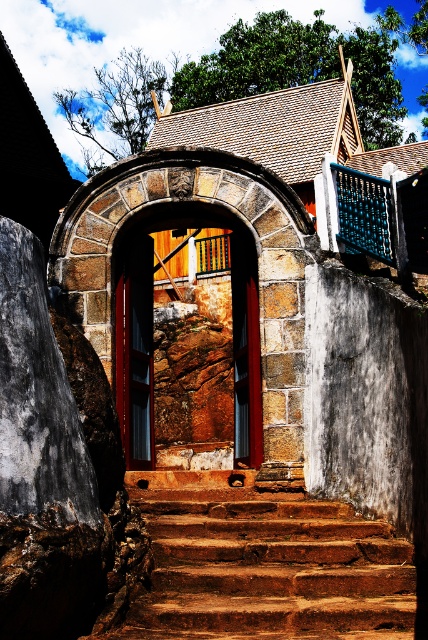
Question: Can you confirm if rustic stone archway at center is positioned above matte wood door at center?

Choices:
 (A) yes
 (B) no

Answer: (B)

Question: Which object is farther from the camera taking this photo?

Choices:
 (A) rustic stone archway at center
 (B) matte wood door at center
 (C) brown rustic stairs at center

Answer: (B)

Question: Does brown rustic stairs at center have a lesser width compared to matte wood door at center?

Choices:
 (A) no
 (B) yes

Answer: (A)

Question: Which point is closer to the camera taking this photo?

Choices:
 (A) (146, 436)
 (B) (259, 435)

Answer: (B)

Question: Is rustic stone archway at center positioned in front of matte wood door at center?

Choices:
 (A) no
 (B) yes

Answer: (B)

Question: Among these points, which one is nearest to the camera?

Choices:
 (A) pos(220,250)
 (B) pos(134,353)

Answer: (B)